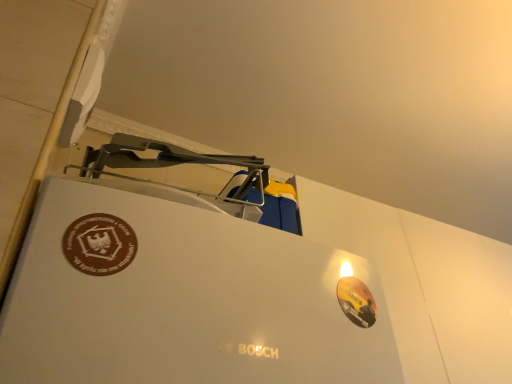
Identify the location of glossy orange sticker at lower right, the 1th logo in the bottom-to-top sequence. (356, 301).

Image resolution: width=512 pixels, height=384 pixels. What do you see at coordinates (356, 301) in the screenshot?
I see `glossy orange sticker at lower right, which is counted as the first logo, starting from the right` at bounding box center [356, 301].

Locate an element on the screen. brown matte sticker at upper left, the 2th logo when ordered from bottom to top is located at coordinates (99, 244).

Describe the element at coordinates (99, 244) in the screenshot. I see `brown matte sticker at upper left, which is the 1th logo from left to right` at that location.

Identify the location of glossy orange sticker at lower right, the second logo viewed from the front. (356, 301).

Can you confirm if glossy orange sticker at lower right, the second logo viewed from the front, is positioned to the left of brown matte sticker at upper left, which appears as the 1th logo when viewed from the front?

No, glossy orange sticker at lower right, the second logo viewed from the front, is not to the left of brown matte sticker at upper left, which appears as the 1th logo when viewed from the front.

Does glossy orange sticker at lower right, the second logo viewed from the front, come behind brown matte sticker at upper left, placed as the 2th logo when sorted from right to left?

Yes, glossy orange sticker at lower right, the second logo viewed from the front, is behind brown matte sticker at upper left, placed as the 2th logo when sorted from right to left.

Which point is more distant from viewer, (364, 290) or (65, 255)?

Point (364, 290)

Consider the image. From the image's perspective, relative to brown matte sticker at upper left, the second logo from the back, is glossy orange sticker at lower right, the second logo viewed from the front, above or below?

glossy orange sticker at lower right, the second logo viewed from the front, is below brown matte sticker at upper left, the second logo from the back.

From a real-world perspective, is glossy orange sticker at lower right, the second logo positioned from the left, positioned above or below brown matte sticker at upper left, the second logo from the back?

From a real-world perspective, glossy orange sticker at lower right, the second logo positioned from the left, is physically below brown matte sticker at upper left, the second logo from the back.

Considering the sizes of glossy orange sticker at lower right, positioned as the first logo in back-to-front order, and brown matte sticker at upper left, which is the 1th logo from left to right, in the image, is glossy orange sticker at lower right, positioned as the first logo in back-to-front order, wider or thinner than brown matte sticker at upper left, which is the 1th logo from left to right,?

Clearly, glossy orange sticker at lower right, positioned as the first logo in back-to-front order, has more width compared to brown matte sticker at upper left, which is the 1th logo from left to right.

In terms of height, does glossy orange sticker at lower right, the second logo viewed from the front, look taller or shorter compared to brown matte sticker at upper left, which ranks as the first logo in top-to-bottom order?

Clearly, glossy orange sticker at lower right, the second logo viewed from the front, is shorter compared to brown matte sticker at upper left, which ranks as the first logo in top-to-bottom order.

Which of these two, glossy orange sticker at lower right, positioned as the first logo in back-to-front order, or brown matte sticker at upper left, which is the 1th logo from left to right, is bigger?

glossy orange sticker at lower right, positioned as the first logo in back-to-front order.

Is glossy orange sticker at lower right, positioned as the first logo in back-to-front order, not inside brown matte sticker at upper left, which is the 1th logo from left to right?

Indeed, glossy orange sticker at lower right, positioned as the first logo in back-to-front order, is completely outside brown matte sticker at upper left, which is the 1th logo from left to right.

Is glossy orange sticker at lower right, the second logo viewed from the top, not near brown matte sticker at upper left, which appears as the 1th logo when viewed from the front?

Actually, glossy orange sticker at lower right, the second logo viewed from the top, and brown matte sticker at upper left, which appears as the 1th logo when viewed from the front, are a little close together.

Is glossy orange sticker at lower right, positioned as the first logo in back-to-front order, oriented towards brown matte sticker at upper left, the second logo from the back?

No.

How distant is glossy orange sticker at lower right, the second logo viewed from the top, from brown matte sticker at upper left, the second logo from the back?

A distance of 14.74 inches exists between glossy orange sticker at lower right, the second logo viewed from the top, and brown matte sticker at upper left, the second logo from the back.

Locate an element on the screen. logo above the glossy orange sticker at lower right, the second logo positioned from the left (from the image's perspective) is located at coordinates (99, 244).

Visually, is brown matte sticker at upper left, the 2th logo when ordered from bottom to top, positioned to the left or to the right of glossy orange sticker at lower right, the second logo positioned from the left?

brown matte sticker at upper left, the 2th logo when ordered from bottom to top, is to the left of glossy orange sticker at lower right, the second logo positioned from the left.

Consider the image. Considering the positions of objects brown matte sticker at upper left, which appears as the 1th logo when viewed from the front, and glossy orange sticker at lower right, the second logo viewed from the top, in the image provided, who is in front, brown matte sticker at upper left, which appears as the 1th logo when viewed from the front, or glossy orange sticker at lower right, the second logo viewed from the top,?

brown matte sticker at upper left, which appears as the 1th logo when viewed from the front, is closer to the camera.

Considering the positions of point (92, 226) and point (340, 282), is point (92, 226) closer or farther from the camera than point (340, 282)?

Point (92, 226).

From the image's perspective, does brown matte sticker at upper left, which ranks as the first logo in top-to-bottom order, appear lower than glossy orange sticker at lower right, positioned as the first logo in back-to-front order?

No, from the image's perspective, brown matte sticker at upper left, which ranks as the first logo in top-to-bottom order, is not beneath glossy orange sticker at lower right, positioned as the first logo in back-to-front order.

From a real-world perspective, who is located higher, brown matte sticker at upper left, which ranks as the first logo in top-to-bottom order, or glossy orange sticker at lower right, the second logo positioned from the left?

brown matte sticker at upper left, which ranks as the first logo in top-to-bottom order, is physically above.

Which object is thinner, brown matte sticker at upper left, the second logo from the back, or glossy orange sticker at lower right, the second logo viewed from the top?

brown matte sticker at upper left, the second logo from the back.

Is brown matte sticker at upper left, the 2th logo when ordered from bottom to top, shorter than glossy orange sticker at lower right, the second logo positioned from the left?

No, brown matte sticker at upper left, the 2th logo when ordered from bottom to top, is not shorter than glossy orange sticker at lower right, the second logo positioned from the left.

Based on their sizes in the image, would you say brown matte sticker at upper left, the 2th logo when ordered from bottom to top, is bigger or smaller than glossy orange sticker at lower right, the second logo positioned from the left?

Considering their sizes, brown matte sticker at upper left, the 2th logo when ordered from bottom to top, takes up less space than glossy orange sticker at lower right, the second logo positioned from the left.

From the picture: Which is correct: brown matte sticker at upper left, the 2th logo when ordered from bottom to top, is inside glossy orange sticker at lower right, positioned as the first logo in back-to-front order, or outside of it?

brown matte sticker at upper left, the 2th logo when ordered from bottom to top, exists outside the volume of glossy orange sticker at lower right, positioned as the first logo in back-to-front order.

Are brown matte sticker at upper left, the 2th logo when ordered from bottom to top, and glossy orange sticker at lower right, the second logo viewed from the top, making contact?

No, brown matte sticker at upper left, the 2th logo when ordered from bottom to top, is not making contact with glossy orange sticker at lower right, the second logo viewed from the top.

Is brown matte sticker at upper left, which ranks as the first logo in top-to-bottom order, positioned with its back to glossy orange sticker at lower right, the second logo positioned from the left?

No, brown matte sticker at upper left, which ranks as the first logo in top-to-bottom order,'s orientation is not away from glossy orange sticker at lower right, the second logo positioned from the left.

How many degrees apart are the facing directions of brown matte sticker at upper left, which is the 1th logo from left to right, and glossy orange sticker at lower right, the second logo viewed from the top?

6.83 degrees separate the facing orientations of brown matte sticker at upper left, which is the 1th logo from left to right, and glossy orange sticker at lower right, the second logo viewed from the top.

How distant is brown matte sticker at upper left, which is the 1th logo from left to right, from glossy orange sticker at lower right, the 1th logo in the bottom-to-top sequence?

brown matte sticker at upper left, which is the 1th logo from left to right, is 14.74 inches away from glossy orange sticker at lower right, the 1th logo in the bottom-to-top sequence.

Where is `logo behind the brown matte sticker at upper left, which ranks as the first logo in top-to-bottom order`? logo behind the brown matte sticker at upper left, which ranks as the first logo in top-to-bottom order is located at coordinates (356, 301).

The image size is (512, 384). In order to click on logo below the brown matte sticker at upper left, placed as the 2th logo when sorted from right to left (from a real-world perspective) in this screenshot , I will do `click(356, 301)`.

Where is `logo in front of the glossy orange sticker at lower right, the second logo positioned from the left`? This screenshot has width=512, height=384. logo in front of the glossy orange sticker at lower right, the second logo positioned from the left is located at coordinates (99, 244).